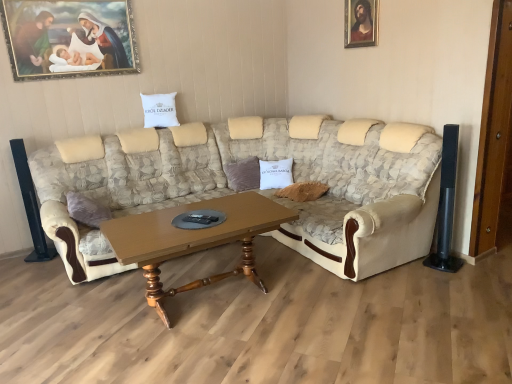
Question: From the image's perspective, is white cotton pillow at center, positioned as the 2th pillow in top-to-bottom order, below beige fabric couch at center?

Choices:
 (A) yes
 (B) no

Answer: (B)

Question: Are white cotton pillow at center, which is counted as the 1th pillow, starting from the right, and beige fabric couch at center far apart?

Choices:
 (A) yes
 (B) no

Answer: (B)

Question: Is white cotton pillow at center, which is counted as the 1th pillow, starting from the right, bigger than beige fabric couch at center?

Choices:
 (A) no
 (B) yes

Answer: (A)

Question: Is white cotton pillow at center, which appears as the first pillow when ordered from the bottom, thinner than beige fabric couch at center?

Choices:
 (A) yes
 (B) no

Answer: (A)

Question: Is white cotton pillow at center, which appears as the first pillow when ordered from the bottom, taller than beige fabric couch at center?

Choices:
 (A) yes
 (B) no

Answer: (B)

Question: Considering the relative positions of white cotton pillow at center, which is counted as the 1th pillow, starting from the right, and beige fabric couch at center in the image provided, is white cotton pillow at center, which is counted as the 1th pillow, starting from the right, in front of beige fabric couch at center?

Choices:
 (A) yes
 (B) no

Answer: (B)

Question: Is white cotton pillow at center, which is the 2th pillow from left to right, in front of wooden framed portrait at upper right, arranged as the first picture frame when viewed from the right?

Choices:
 (A) no
 (B) yes

Answer: (A)

Question: Is white cotton pillow at center, positioned as the 2th pillow in top-to-bottom order, smaller than wooden framed portrait at upper right, which is counted as the second picture frame, starting from the left?

Choices:
 (A) no
 (B) yes

Answer: (A)

Question: From a real-world perspective, is white cotton pillow at center, which is the 2th pillow from left to right, physically above wooden framed portrait at upper right, which is counted as the second picture frame, starting from the left?

Choices:
 (A) no
 (B) yes

Answer: (A)

Question: From the image's perspective, is white cotton pillow at center, positioned as the 2th pillow in top-to-bottom order, beneath wooden framed portrait at upper right, which is counted as the second picture frame, starting from the left?

Choices:
 (A) yes
 (B) no

Answer: (A)

Question: Is white cotton pillow at center, which is the 2th pillow from left to right, to the left of wooden framed portrait at upper right, which is counted as the second picture frame, starting from the left, from the viewer's perspective?

Choices:
 (A) no
 (B) yes

Answer: (B)

Question: Can you confirm if white cotton pillow at center, which appears as the first pillow when ordered from the bottom, is taller than wooden framed portrait at upper right, arranged as the first picture frame when viewed from the right?

Choices:
 (A) no
 (B) yes

Answer: (A)

Question: From the image's perspective, is gold-framed painting at upper left, acting as the second picture frame starting from the right, beneath white cotton pillow at center, the first pillow from the top?

Choices:
 (A) no
 (B) yes

Answer: (A)